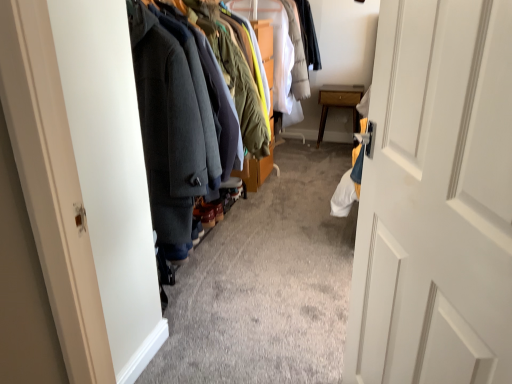
This screenshot has width=512, height=384. In order to click on wooden nightstand at center in this screenshot , I will do `click(339, 103)`.

Measure the distance between wooden nightstand at center and camera.

The distance of wooden nightstand at center from camera is 3.98 meters.

What do you see at coordinates (339, 103) in the screenshot? I see `wooden nightstand at center` at bounding box center [339, 103].

Locate an element on the screen. wooden nightstand at center is located at coordinates (339, 103).